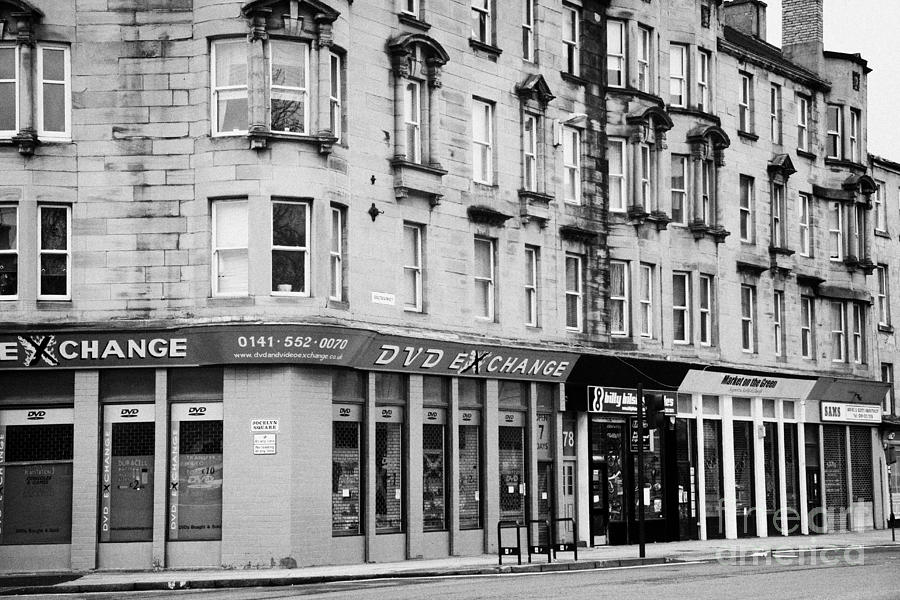
The image size is (900, 600). Identify the location of curtains. (216, 68).